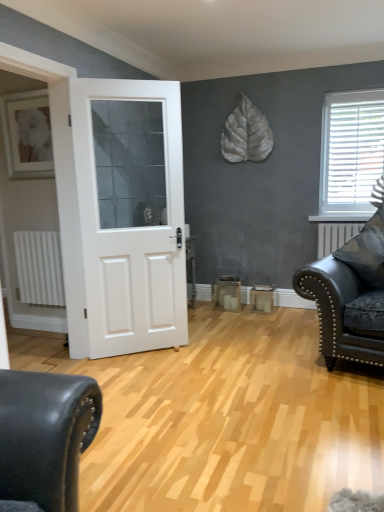
From the picture: Measure the distance between point (340, 272) and camera.

Point (340, 272) and camera are 2.93 meters apart.

This screenshot has height=512, width=384. What do you see at coordinates (351, 293) in the screenshot?
I see `matte black leather couch at right` at bounding box center [351, 293].

Describe the element at coordinates (27, 134) in the screenshot. This screenshot has height=512, width=384. I see `matte white picture frame at upper left` at that location.

Find the location of a particular element. The height and width of the screenshot is (512, 384). white plastic blinds at upper right is located at coordinates (351, 151).

In the scene shown: Considering the sizes of matte black leather couch at right and white matte door at center in the image, is matte black leather couch at right bigger or smaller than white matte door at center?

matte black leather couch at right is bigger than white matte door at center.

Is matte black leather couch at right not within white matte door at center?

Yes, matte black leather couch at right is located beyond the bounds of white matte door at center.

Is matte black leather couch at right facing away from white matte door at center?

That's not correct — matte black leather couch at right is not looking away from white matte door at center.

Looking at this image, from a real-world perspective, is white matte door at center positioned over white plastic blinds at upper right based on gravity?

No.

Is white matte door at center positioned beyond the bounds of white plastic blinds at upper right?

Yes, white matte door at center is not within white plastic blinds at upper right.

Between white matte door at center and white plastic blinds at upper right, which one has more height?

Standing taller between the two is white matte door at center.

Based on the photo, which is nearer, [164,258] or [340,108]?

Point [164,258].

Looking at this image, from the image's perspective, is white plastic blinds at upper right located above or below matte white picture frame at upper left?

Based on their image positions, white plastic blinds at upper right is located beneath matte white picture frame at upper left.

Which is farther, (350, 114) or (19, 101)?

The point (350, 114) is more distant.

From a real-world perspective, is white plastic blinds at upper right located higher than matte white picture frame at upper left?

Incorrect, from a real-world perspective, white plastic blinds at upper right is lower than matte white picture frame at upper left.

Is white plastic blinds at upper right outside of matte white picture frame at upper left?

That's correct, white plastic blinds at upper right is outside of matte white picture frame at upper left.

In the scene shown: From the image's perspective, is white matte radiator at left located above or below white matte door at center?

white matte radiator at left is situated lower than white matte door at center in the image.

From a real-world perspective, is white matte radiator at left on top of white matte door at center?

No, from a real-world perspective, white matte radiator at left is not over white matte door at center

Considering the relative positions of white matte radiator at left and white matte door at center in the image provided, is white matte radiator at left to the left or to the right of white matte door at center?

Based on their positions, white matte radiator at left is located to the left of white matte door at center.

How much distance is there between white matte radiator at left and white matte door at center?

They are 30.90 inches apart.

From the image's perspective, is matte white picture frame at upper left above or below white plastic blinds at upper right?

Based on their image positions, matte white picture frame at upper left is located above white plastic blinds at upper right.

Consider the image. Visually, is matte white picture frame at upper left positioned to the left or to the right of white plastic blinds at upper right?

matte white picture frame at upper left is positioned on white plastic blinds at upper right's left side.

How many degrees apart are the facing directions of matte white picture frame at upper left and white plastic blinds at upper right?

The angular difference between matte white picture frame at upper left and white plastic blinds at upper right is 0.121 degrees.

From a real-world perspective, does white matte door at center stand above matte white picture frame at upper left?

No.

From the picture: Which object is positioned more to the right, white matte door at center or matte white picture frame at upper left?

From the viewer's perspective, white matte door at center appears more on the right side.

Who is smaller, white matte door at center or matte white picture frame at upper left?

matte white picture frame at upper left is smaller.

Which is nearer, (95, 248) or (20, 145)?

Point (95, 248).

Is matte black leather couch at right taller than matte white picture frame at upper left?

Correct, matte black leather couch at right is much taller as matte white picture frame at upper left.

From the image's perspective, is matte black leather couch at right above matte white picture frame at upper left?

No.

From a real-world perspective, who is located lower, matte black leather couch at right or matte white picture frame at upper left?

From a 3D spatial view, matte black leather couch at right is below.

Locate an element on the screen. This screenshot has width=384, height=512. studio couch that is below the matte white picture frame at upper left (from the image's perspective) is located at coordinates (351, 293).

The height and width of the screenshot is (512, 384). Find the location of `studio couch that appears in front of the white matte door at center`. studio couch that appears in front of the white matte door at center is located at coordinates (351, 293).

In the image, there is a white plastic blinds at upper right. Where is `door below it (from a real-world perspective)`? Image resolution: width=384 pixels, height=512 pixels. door below it (from a real-world perspective) is located at coordinates (121, 228).

Looking at the image, which one is located further to white plastic blinds at upper right, matte black leather couch at right or white matte radiator at left?

Based on the image, white matte radiator at left appears to be further to white plastic blinds at upper right.

When comparing their distances from matte black leather couch at right, does white plastic blinds at upper right or white matte door at center seem closer?

white plastic blinds at upper right is closer to matte black leather couch at right.

Looking at the image, which one is located further to white matte door at center, matte white picture frame at upper left or white matte radiator at left?

matte white picture frame at upper left is further to white matte door at center.

From the image, which object appears to be nearer to white matte door at center, white plastic blinds at upper right or matte black leather couch at right?

The object closer to white matte door at center is matte black leather couch at right.

Based on their spatial positions, is white matte radiator at left or matte white picture frame at upper left further from matte black leather couch at right?

matte white picture frame at upper left.

From the picture: Looking at the image, which one is located closer to white matte radiator at left, matte white picture frame at upper left or white matte door at center?

Among the two, white matte door at center is located nearer to white matte radiator at left.

When comparing their distances from matte white picture frame at upper left, does matte black leather couch at right or white matte radiator at left seem further?

Among the two, matte black leather couch at right is located further to matte white picture frame at upper left.

Estimate the real-world distances between objects in this image. Which object is closer to matte white picture frame at upper left, white matte radiator at left or matte black leather couch at right?

white matte radiator at left is closer to matte white picture frame at upper left.

This screenshot has height=512, width=384. I want to click on door between white matte radiator at left and white plastic blinds at upper right in the horizontal direction, so click(x=121, y=228).

In order to click on radiator situated between matte white picture frame at upper left and white plastic blinds at upper right from left to right in this screenshot , I will do `click(39, 268)`.

Locate an element on the screen. The image size is (384, 512). door between matte white picture frame at upper left and white matte radiator at left vertically is located at coordinates 121,228.

Identify the location of door between matte white picture frame at upper left and matte black leather couch at right in the horizontal direction. (121, 228).